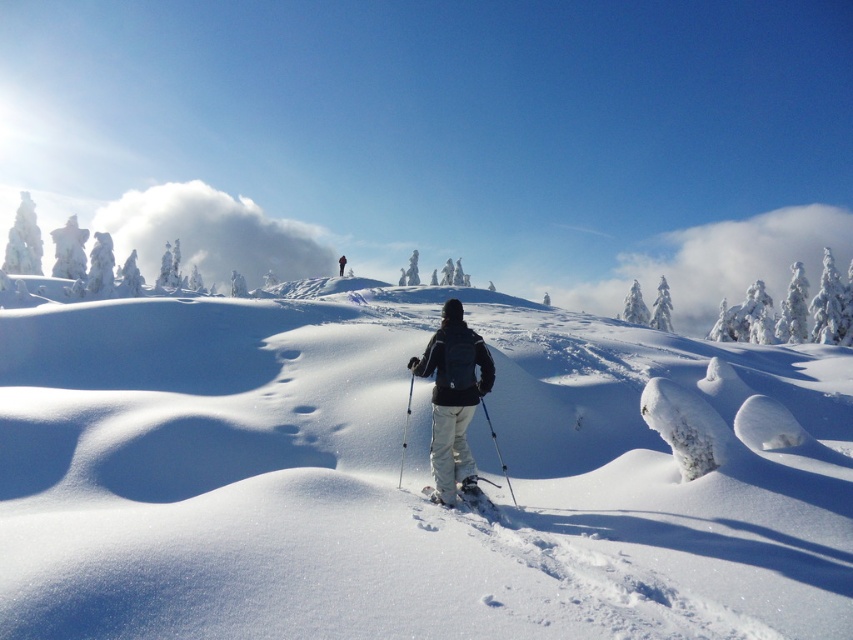
You are a photographer trying to capture the perfect shot of the white fluffy snow at center and the translucent blue ski pole at center. Which object would you focus on first if you want to include both in the frame without cropping?

The white fluffy snow at center is bigger than the translucent blue ski pole at center, so you should focus on the white fluffy snow at center first to ensure it fits properly in the frame.

You are a photographer planning to take a photo of the winter landscape. You want to include both the point at coordinates point [492,513] and point [341,262] in your frame. Which point should you focus on first to ensure both are in sharp focus?

You should focus on point [492,513] first because it is closer to the viewer than point [341,262], allowing the camera to adjust the depth of field to include both points in sharp focus.

Looking at this image, you are a photographer trying to capture the perfect shot of the white matte ski at center and the black fabric jacket at center. You want to ensure that both objects are in focus. Given that your camera can only focus on objects within a 10 cm width difference, can you achieve this?

The white matte ski at center has a width less than the black fabric jacket at center. Since the camera can focus on objects within a 10 cm width difference, as long as the width difference between them is within 10 cm, it should be possible. However, the exact width values are not provided, so we cannot confirm definitively.